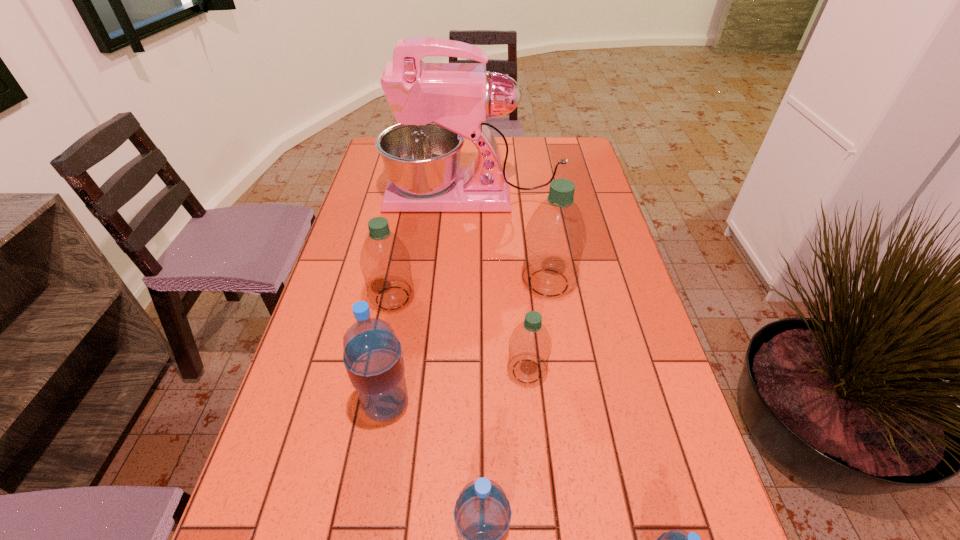
At what (x,y) coordinates should I click in order to perform the action: click on mixer. Please return your answer as a coordinate pair (x, y). Image resolution: width=960 pixels, height=540 pixels. Looking at the image, I should click on (436, 105).

Where is `the tallest object`? the tallest object is located at coordinates (436, 105).

The image size is (960, 540). In order to click on the farthest blue water bottle in this screenshot , I will do `click(373, 358)`.

At what (x,y) coordinates should I click in order to perform the action: click on the biggest blue water bottle. Please return your answer as a coordinate pair (x, y). This screenshot has height=540, width=960. Looking at the image, I should click on 373,358.

Where is `the biggest green water bottle`? the biggest green water bottle is located at coordinates (555, 237).

Where is `the leftmost green water bottle`? the leftmost green water bottle is located at coordinates (385, 263).

The height and width of the screenshot is (540, 960). Identify the location of the smallest green water bottle. (530, 346).

Where is `blank area located on the left of the leftmost blue water bottle`? blank area located on the left of the leftmost blue water bottle is located at coordinates (299, 405).

The height and width of the screenshot is (540, 960). I want to click on vacant area located on the back of the biggest green water bottle, so click(x=537, y=207).

What are the coordinates of `vacant region located 0.350m on the back of the leftmost green water bottle` in the screenshot? It's located at (411, 206).